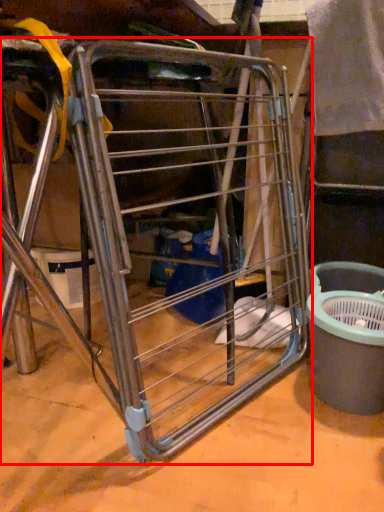
Question: From the image's perspective, what is the correct spatial positioning of furniture (annotated by the red box) in reference to recycling bin?

Choices:
 (A) above
 (B) below

Answer: (A)